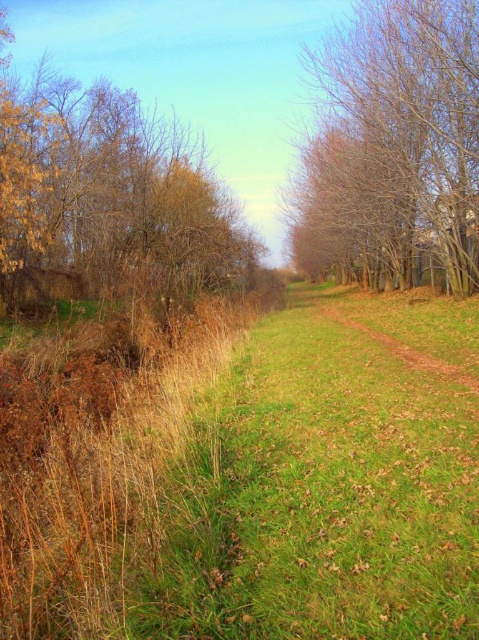
Does bare branches at center have a lesser height compared to yellowish-brown textured tree at left?

Indeed, bare branches at center has a lesser height compared to yellowish-brown textured tree at left.

This screenshot has width=479, height=640. I want to click on bare branches at center, so click(397, 141).

Image resolution: width=479 pixels, height=640 pixels. What do you see at coordinates (397, 141) in the screenshot? I see `bare branches at center` at bounding box center [397, 141].

Where is `bare branches at center`? Image resolution: width=479 pixels, height=640 pixels. bare branches at center is located at coordinates (397, 141).

The height and width of the screenshot is (640, 479). What do you see at coordinates (109, 200) in the screenshot? I see `brown dry grass at left` at bounding box center [109, 200].

Identify the location of brown dry grass at left. (109, 200).

At what (x,y) coordinates should I click in order to perform the action: click on brown dry grass at left. Please return your answer as a coordinate pair (x, y). This screenshot has width=479, height=640. Looking at the image, I should click on (109, 200).

Is brown dry grass at left smaller than bare branches at center?

Answer: No.

Can you confirm if brown dry grass at left is positioned below bare branches at center?

No, brown dry grass at left is not below bare branches at center.

In order to click on brown dry grass at left in this screenshot , I will do `click(109, 200)`.